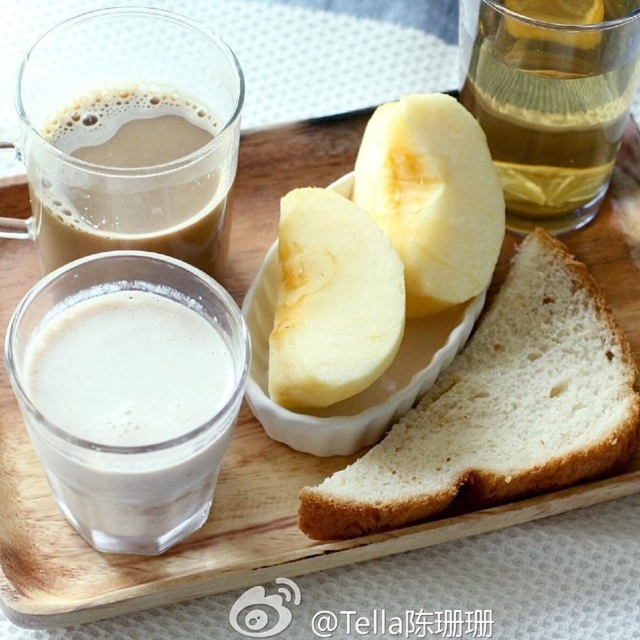
Does translucent glass at upper right have a larger size compared to yellow matte banana at center?

Correct, translucent glass at upper right is larger in size than yellow matte banana at center.

How far apart are translucent glass at upper right and yellow matte banana at center?

translucent glass at upper right and yellow matte banana at center are 4.06 inches apart.

Between point (524, 68) and point (448, 298), which one is positioned behind?

The point (448, 298) is behind.

Locate an element on the screen. translucent glass at upper right is located at coordinates (550, 99).

Can you confirm if white frothy coffee at lower left is taller than yellow matte banana at center?

Correct, white frothy coffee at lower left is much taller as yellow matte banana at center.

Looking at this image, which is more to the right, white frothy coffee at lower left or yellow matte banana at center?

From the viewer's perspective, yellow matte banana at center appears more on the right side.

What do you see at coordinates (129, 412) in the screenshot?
I see `white frothy coffee at lower left` at bounding box center [129, 412].

Where is `white frothy coffee at lower left`? The width and height of the screenshot is (640, 640). white frothy coffee at lower left is located at coordinates (129, 412).

Who is positioned more to the right, translucent glass at upper right or yellow smooth apple at center?

translucent glass at upper right

Which is in front, point (522, 180) or point (324, 323)?

Point (324, 323) is in front.

At what (x,y) coordinates should I click in order to perform the action: click on translucent glass at upper right. Please return your answer as a coordinate pair (x, y). Looking at the image, I should click on (550, 99).